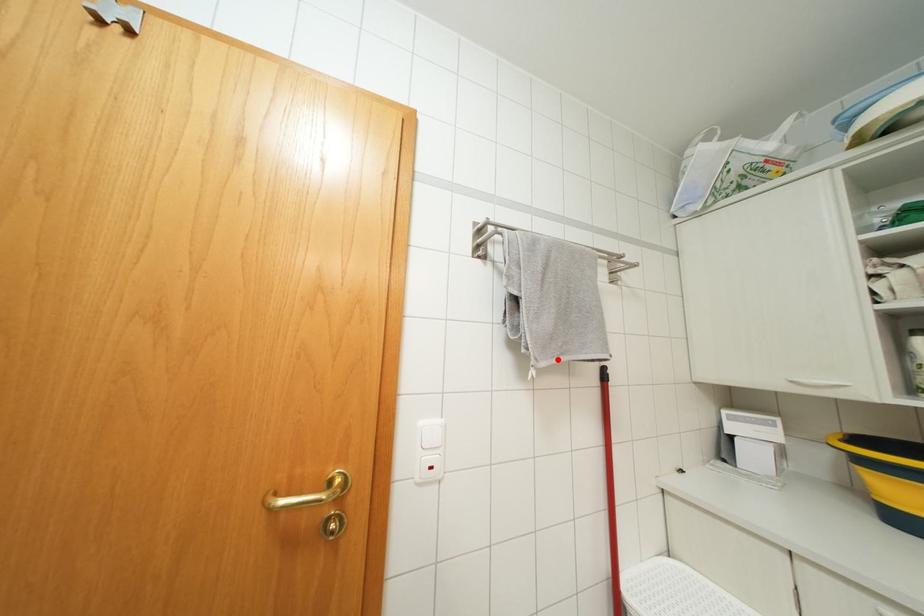
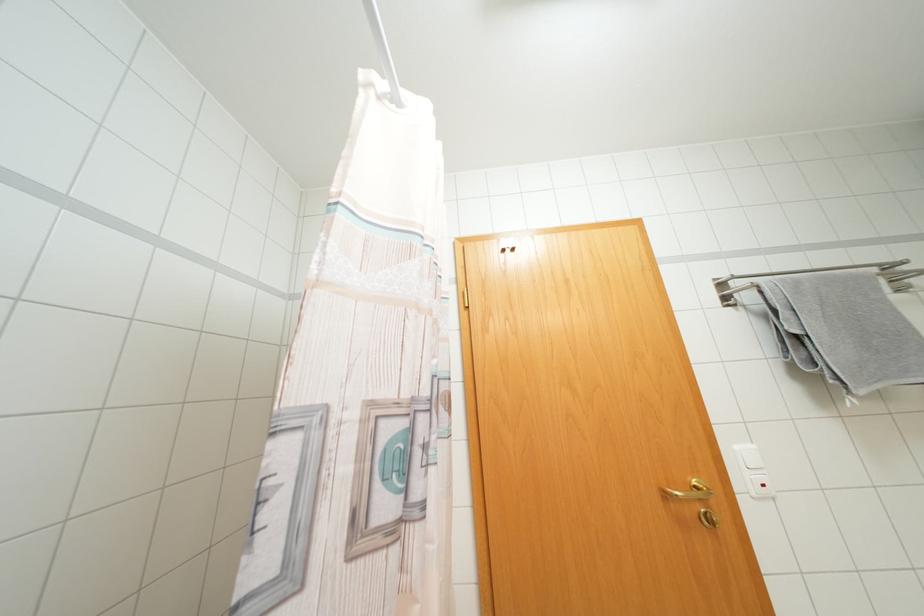
Question: I am providing you with two images of the same scene from different viewpoints. A red point is shown in image1. For the corresponding object point in image2, is it positioned nearer or farther from the camera?

Choices:
 (A) Nearer
 (B) Farther

Answer: (A)